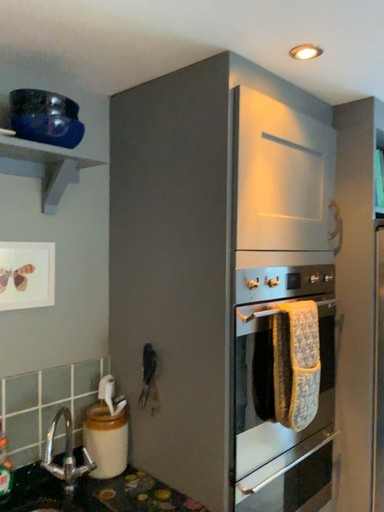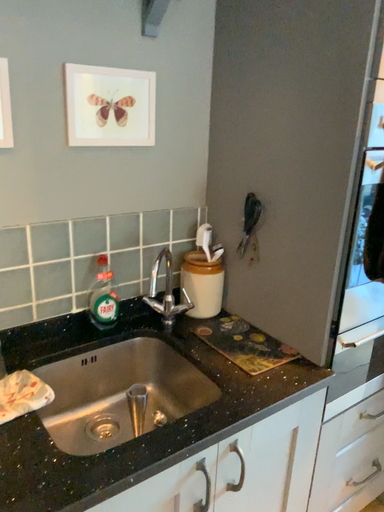
Question: Which way did the camera rotate in the video?

Choices:
 (A) rotated left
 (B) rotated right

Answer: (A)